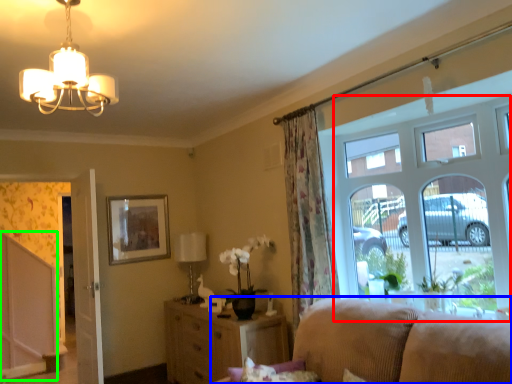
Question: Which is nearer to the window (highlighted by a red box)? studio couch (highlighted by a blue box) or screen door (highlighted by a green box).

Choices:
 (A) studio couch
 (B) screen door

Answer: (A)